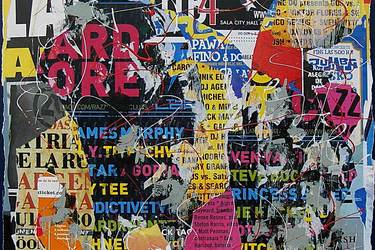
The width and height of the screenshot is (375, 250). What are the coordinates of `beige background` in the screenshot? It's located at (32, 155), (58, 156), (59, 130), (64, 119), (28, 217), (89, 211), (27, 238).